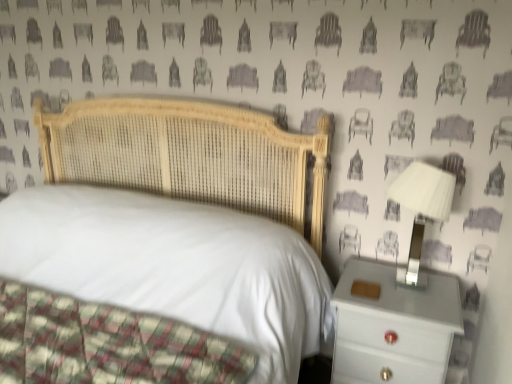
What do you see at coordinates (393, 326) in the screenshot?
I see `white glossy nightstand at right` at bounding box center [393, 326].

Where is `white plastic lampshade at right`? The image size is (512, 384). white plastic lampshade at right is located at coordinates (422, 206).

Identify the location of white glossy nightstand at right. (393, 326).

From a real-world perspective, is white plastic lampshade at right positioned over white glossy nightstand at right based on gravity?

Indeed, from a real-world perspective, white plastic lampshade at right stands above white glossy nightstand at right.

Considering the sizes of objects white plastic lampshade at right and white glossy nightstand at right in the image provided, who is bigger, white plastic lampshade at right or white glossy nightstand at right?

With larger size is white glossy nightstand at right.

From the image's perspective, does white plastic lampshade at right appear lower than white glossy nightstand at right?

Actually, white plastic lampshade at right appears above white glossy nightstand at right in the image.

Is point (412, 204) more distant than point (341, 342)?

No, it is in front of (341, 342).

Considering the positions of point (453, 185) and point (226, 125), is point (453, 185) closer or farther from the camera than point (226, 125)?

Clearly, point (453, 185) is closer to the camera than point (226, 125).

Based on the photo, who is bigger, white plastic lampshade at right or woven wood bed at center?

woven wood bed at center.

From the image's perspective, is white plastic lampshade at right under woven wood bed at center?

Incorrect, from the image's perspective, white plastic lampshade at right is higher than woven wood bed at center.

Does white glossy nightstand at right appear on the left side of woven wood bed at center?

No, white glossy nightstand at right is not to the left of woven wood bed at center.

Does point (428, 309) come in front of point (89, 155)?

Yes, it is in front of point (89, 155).

Considering the sizes of objects white glossy nightstand at right and woven wood bed at center in the image provided, who is smaller, white glossy nightstand at right or woven wood bed at center?

With smaller size is white glossy nightstand at right.

Locate an element on the screen. The image size is (512, 384). bedside lamp above the woven wood bed at center (from the image's perspective) is located at coordinates (422, 206).

From the image's perspective, which is below, woven wood bed at center or white plastic lampshade at right?

woven wood bed at center, from the image's perspective.

Considering the relative sizes of woven wood bed at center and white plastic lampshade at right in the image provided, is woven wood bed at center thinner than white plastic lampshade at right?

No.

Considering their positions, is woven wood bed at center located in front of or behind white plastic lampshade at right?

woven wood bed at center is positioned closer to the viewer than white plastic lampshade at right.

This screenshot has width=512, height=384. Identify the location of bed above the white glossy nightstand at right (from a real-world perspective). (189, 155).

Can you confirm if woven wood bed at center is positioned to the left of white glossy nightstand at right?

Indeed, woven wood bed at center is positioned on the left side of white glossy nightstand at right.

How many degrees apart are the facing directions of woven wood bed at center and white glossy nightstand at right?

The angle between the facing direction of woven wood bed at center and the facing direction of white glossy nightstand at right is 0.0197 degrees.

Is woven wood bed at center completely or partially outside of white glossy nightstand at right?

Yes, woven wood bed at center is not within white glossy nightstand at right.

From the image's perspective, is white glossy nightstand at right above or below white plastic lampshade at right?

Based on their image positions, white glossy nightstand at right is located beneath white plastic lampshade at right.

Is white plastic lampshade at right surrounded by white glossy nightstand at right?

That's incorrect, white plastic lampshade at right is not inside white glossy nightstand at right.

From a real-world perspective, which object rests below the other?

From a 3D spatial view, white glossy nightstand at right is below.

Which is closer to the camera, (386,333) or (441,186)?

The point (441,186) is more forward.

The width and height of the screenshot is (512, 384). Find the location of `bedside lamp behind the white glossy nightstand at right`. bedside lamp behind the white glossy nightstand at right is located at coordinates (422, 206).

Locate an element on the screen. This screenshot has height=384, width=512. bedside lamp above the woven wood bed at center (from a real-world perspective) is located at coordinates (422, 206).

From the picture: When comparing their distances from white plastic lampshade at right, does woven wood bed at center or white glossy nightstand at right seem closer?

white glossy nightstand at right is closer to white plastic lampshade at right.

When comparing their distances from woven wood bed at center, does white plastic lampshade at right or white glossy nightstand at right seem closer?

Among the two, white glossy nightstand at right is located nearer to woven wood bed at center.

Looking at the image, which one is located closer to white glossy nightstand at right, white plastic lampshade at right or woven wood bed at center?

white plastic lampshade at right is closer to white glossy nightstand at right.

Considering their positions, is white glossy nightstand at right positioned further to white plastic lampshade at right than woven wood bed at center?

woven wood bed at center is positioned further to the anchor white plastic lampshade at right.

Looking at the image, which one is located further to white glossy nightstand at right, woven wood bed at center or white plastic lampshade at right?

woven wood bed at center is positioned further to the anchor white glossy nightstand at right.

Considering their positions, is white glossy nightstand at right positioned closer to woven wood bed at center than white plastic lampshade at right?

The object closer to woven wood bed at center is white glossy nightstand at right.

In order to click on nightstand between woven wood bed at center and white plastic lampshade at right in the horizontal direction in this screenshot , I will do `click(393, 326)`.